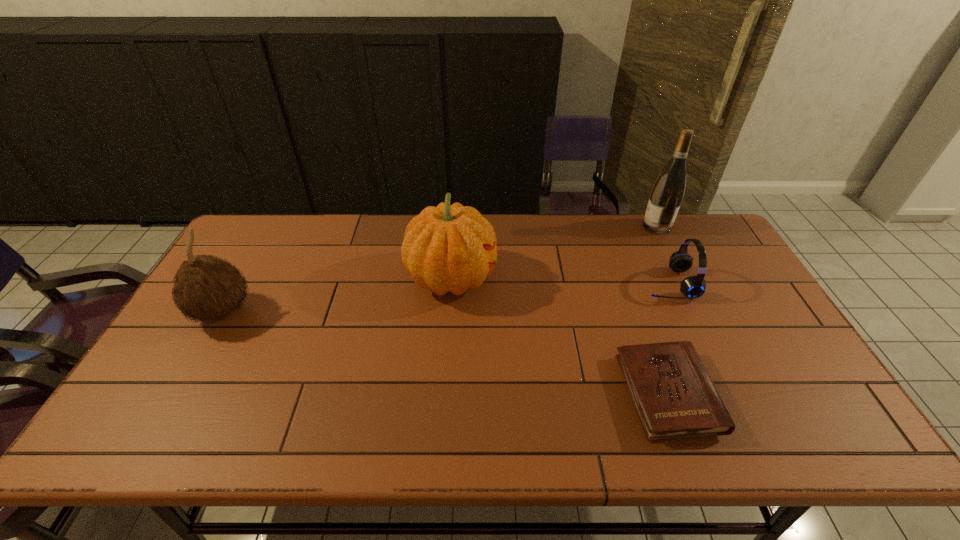
Find the location of a particular element. vacant space located on the carved face of the fourth object from right to left is located at coordinates (557, 278).

Where is `free space located on the surface of the leftmost object`? free space located on the surface of the leftmost object is located at coordinates (290, 312).

Where is `vacant region located 0.160m on the ear cushions of the fourth tallest object`? This screenshot has width=960, height=540. vacant region located 0.160m on the ear cushions of the fourth tallest object is located at coordinates point(591,284).

The height and width of the screenshot is (540, 960). I want to click on vacant region located on the ear cushions of the fourth tallest object, so click(514, 284).

Where is `free space located on the ear cushions of the fourth tallest object`? free space located on the ear cushions of the fourth tallest object is located at coordinates (526, 284).

Identify the location of free location located 0.190m on the back of the shortest object. This screenshot has height=540, width=960. (634, 301).

Where is `wine bottle at the far edge`? wine bottle at the far edge is located at coordinates (667, 194).

Locate an element on the screen. Image resolution: width=960 pixels, height=540 pixels. pumpkin at the far edge is located at coordinates (446, 248).

Locate an element on the screen. This screenshot has width=960, height=540. object at the near edge is located at coordinates (674, 396).

Identify the location of object present at the left edge. (207, 288).